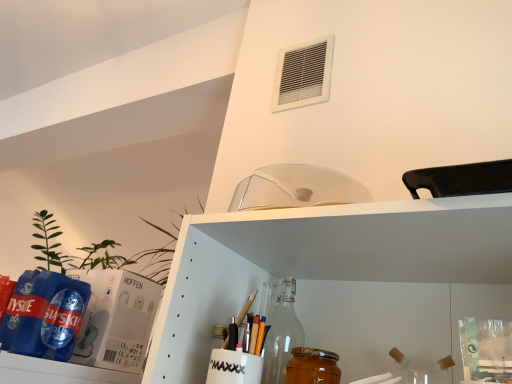
Question: In terms of height, does white plastic air conditioning at upper center look taller or shorter compared to golden honey jar at lower center?

Choices:
 (A) short
 (B) tall

Answer: (B)

Question: In the image, is white plastic air conditioning at upper center positioned in front of or behind golden honey jar at lower center?

Choices:
 (A) front
 (B) behind

Answer: (B)

Question: Is white plastic air conditioning at upper center to the left or to the right of golden honey jar at lower center in the image?

Choices:
 (A) left
 (B) right

Answer: (B)

Question: Would you say golden honey jar at lower center is inside or outside white plastic air conditioning at upper center?

Choices:
 (A) inside
 (B) outside

Answer: (B)

Question: From the image's perspective, is golden honey jar at lower center located above or below white plastic air conditioning at upper center?

Choices:
 (A) below
 (B) above

Answer: (A)

Question: From a real-world perspective, is golden honey jar at lower center physically located above or below white plastic air conditioning at upper center?

Choices:
 (A) above
 (B) below

Answer: (B)

Question: Considering the relative positions of golden honey jar at lower center and white plastic air conditioning at upper center in the image provided, is golden honey jar at lower center to the left or to the right of white plastic air conditioning at upper center?

Choices:
 (A) left
 (B) right

Answer: (A)